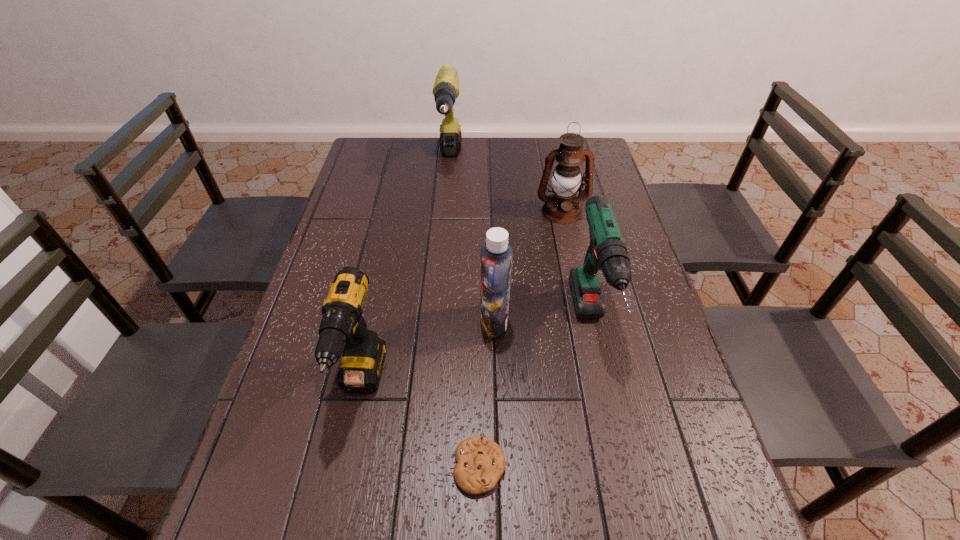
At what (x,y) coordinates should I click in order to perform the action: click on the second drill from left to right. Please return your answer as a coordinate pair (x, y). Looking at the image, I should click on (446, 87).

Where is `the fifth object from right to left`? The image size is (960, 540). the fifth object from right to left is located at coordinates (446, 87).

This screenshot has width=960, height=540. Identify the location of lantern. (562, 206).

The height and width of the screenshot is (540, 960). In order to click on the rightmost drill in this screenshot , I will do `click(607, 251)`.

Identify the location of shampoo. (496, 254).

Where is `the leftmost drill`? the leftmost drill is located at coordinates (363, 356).

Image resolution: width=960 pixels, height=540 pixels. I want to click on the shortest object, so click(480, 461).

Identify the location of cookie. (480, 461).

Find the location of `free location located 0.360m on the handle side of the farthest object`. free location located 0.360m on the handle side of the farthest object is located at coordinates (442, 259).

The image size is (960, 540). I want to click on free space located 0.100m on the side of the lantern, there is a wick adjustment knob, so click(x=569, y=246).